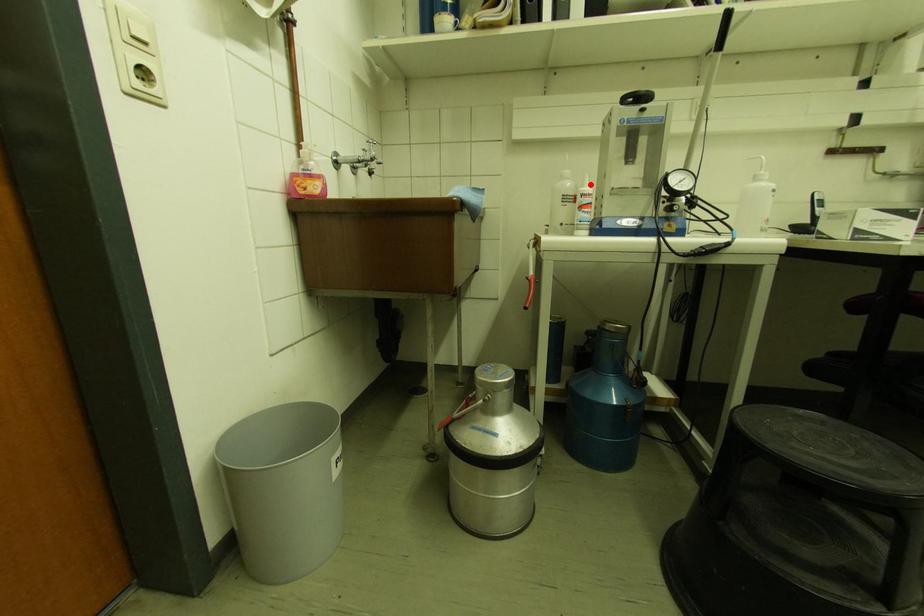
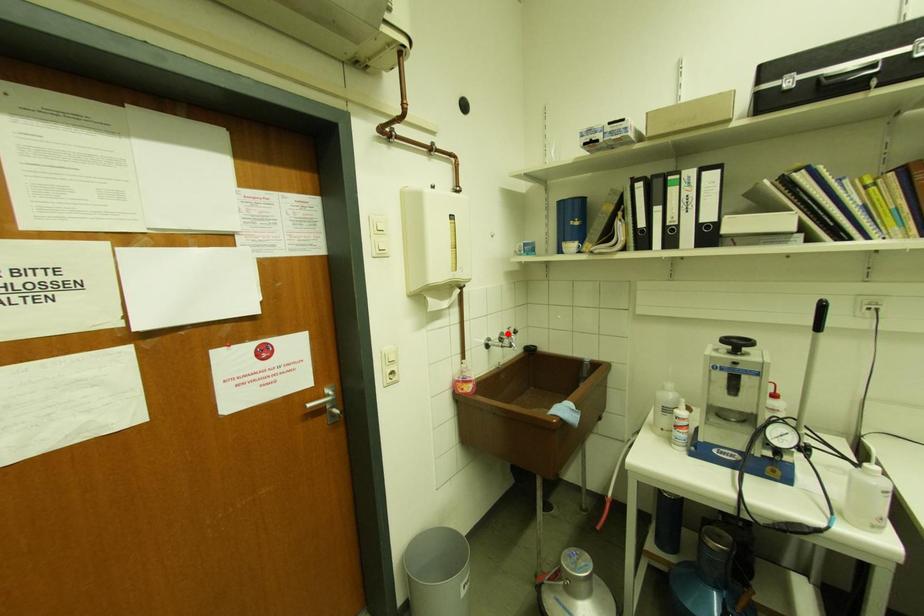
I am providing you with two images of the same scene from different viewpoints. A red point is marked on the first image and another point is marked on the second image. Does the point marked in image1 correspond to the same location as the one in image2?

No